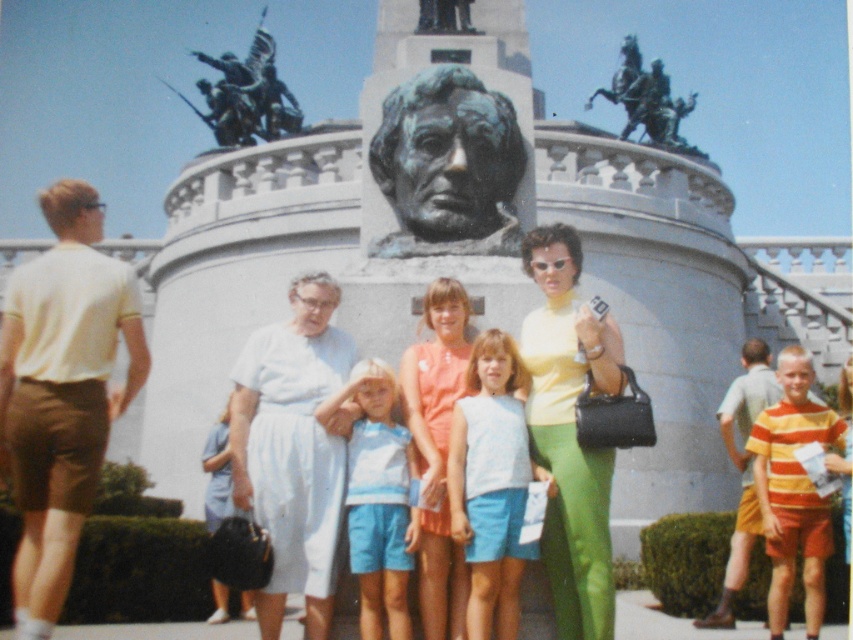
You are a photographer standing near the camera. You want to take a photo of the white cotton dress at center. Is the distance between you and the dress sufficient to capture a clear, detailed image with your standard camera lens?

The white cotton dress at center and camera are 46.64 meters apart. With a standard camera lens, this distance may be too far to capture clear details of the dress. A telephoto lens would be more appropriate for such a long distance.

You are a photographer trying to position a subject in the center of the image. The white cotton dress at center is currently at coordinates point 0.703, 0.343. Are these coordinates the exact center of the image?

The white cotton dress at center is located at point (292, 449), which means it is not exactly at the center of the image since the exact center would be at coordinates like (426, 320).

You are a photographer setting up for a group photo. You notice two dresses in the scene, the matte white dress at center and the matte orange dress at center. Which dress should you adjust to ensure both are visible in the frame considering their heights?

The matte white dress at center is taller than the matte orange dress at center. To ensure both are visible, adjust the matte white dress at center to avoid blocking the shorter one.